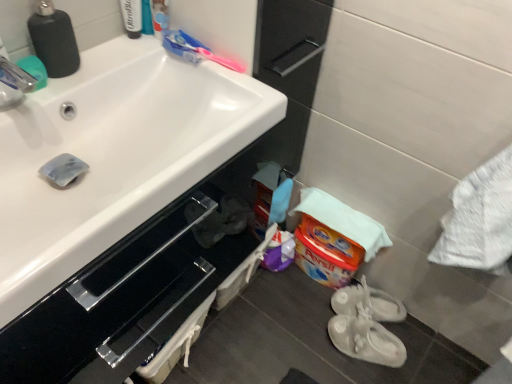
Question: Is translucent plastic toothbrush at upper center, arranged as the first toiletry when viewed from the right, surrounded by white glossy sink at upper left?

Choices:
 (A) yes
 (B) no

Answer: (B)

Question: Considering the relative sizes of white glossy sink at upper left and translucent plastic toothbrush at upper center, arranged as the first toiletry when viewed from the right, in the image provided, is white glossy sink at upper left thinner than translucent plastic toothbrush at upper center, arranged as the first toiletry when viewed from the right,?

Choices:
 (A) yes
 (B) no

Answer: (B)

Question: Is white glossy sink at upper left smaller than translucent plastic toothbrush at upper center, arranged as the first toiletry when viewed from the right?

Choices:
 (A) yes
 (B) no

Answer: (B)

Question: From the image's perspective, is white glossy sink at upper left located above translucent plastic toothbrush at upper center, arranged as the first toiletry when viewed from the right?

Choices:
 (A) yes
 (B) no

Answer: (B)

Question: From a real-world perspective, is white glossy sink at upper left beneath translucent plastic toothbrush at upper center, arranged as the first toiletry when viewed from the right?

Choices:
 (A) no
 (B) yes

Answer: (B)

Question: Considering the positions of point (202, 57) and point (138, 26), is point (202, 57) closer or farther from the camera than point (138, 26)?

Choices:
 (A) closer
 (B) farther

Answer: (A)

Question: From a real-world perspective, is pink plastic toothbrush at upper center positioned above or below white glossy tube at upper left, the first toiletry positioned from the left?

Choices:
 (A) below
 (B) above

Answer: (A)

Question: Considering the positions of pink plastic toothbrush at upper center and white glossy tube at upper left, the first toiletry positioned from the left, in the image, is pink plastic toothbrush at upper center bigger or smaller than white glossy tube at upper left, the first toiletry positioned from the left,?

Choices:
 (A) big
 (B) small

Answer: (A)

Question: Looking at their shapes, would you say pink plastic toothbrush at upper center is wider or thinner than white glossy tube at upper left, which ranks as the 2th toiletry in right-to-left order?

Choices:
 (A) wide
 (B) thin

Answer: (B)

Question: Would you say white glossy sink at upper left is to the left or to the right of white glossy tube at upper left, the first toiletry positioned from the left, in the picture?

Choices:
 (A) left
 (B) right

Answer: (A)

Question: From the image's perspective, is white glossy sink at upper left located above or below white glossy tube at upper left, which ranks as the 2th toiletry in right-to-left order?

Choices:
 (A) below
 (B) above

Answer: (A)

Question: Relative to white glossy tube at upper left, the first toiletry positioned from the left, is white glossy sink at upper left in front or behind?

Choices:
 (A) behind
 (B) front

Answer: (B)

Question: From a real-world perspective, is white glossy sink at upper left above or below white glossy tube at upper left, the first toiletry positioned from the left?

Choices:
 (A) above
 (B) below

Answer: (B)

Question: From the image's perspective, is pink plastic toothbrush at upper center above or below translucent plastic toothbrush at upper center, arranged as the first toiletry when viewed from the right?

Choices:
 (A) below
 (B) above

Answer: (A)

Question: Relative to translucent plastic toothbrush at upper center, arranged as the first toiletry when viewed from the right, is pink plastic toothbrush at upper center in front or behind?

Choices:
 (A) behind
 (B) front

Answer: (A)